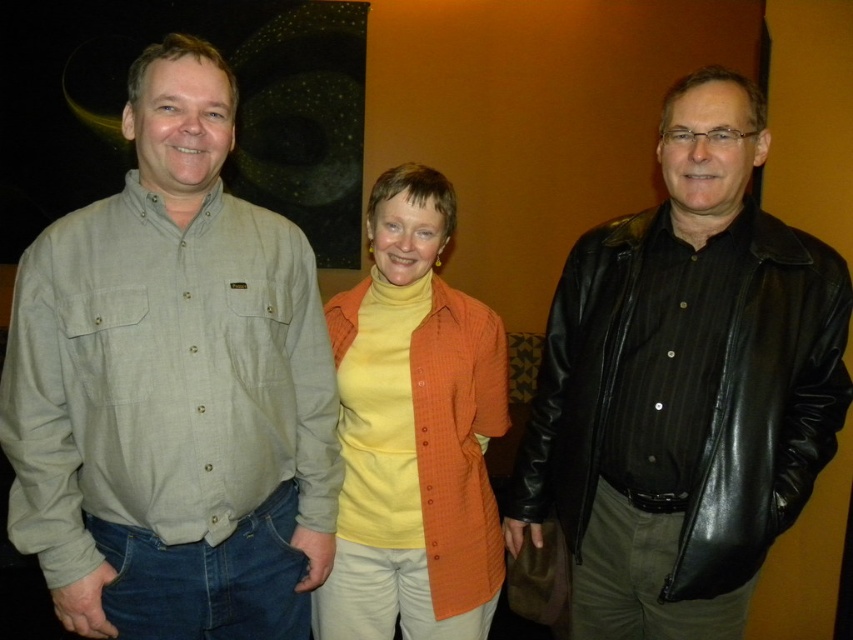
Question: Is black leather jacket at right thinner than orange textured cardigan at center?

Choices:
 (A) no
 (B) yes

Answer: (A)

Question: Which point is closer to the camera taking this photo?

Choices:
 (A) tap(352, 320)
 (B) tap(62, 444)

Answer: (B)

Question: Is black leather jacket at right positioned before orange textured cardigan at center?

Choices:
 (A) no
 (B) yes

Answer: (B)

Question: Among these points, which one is nearest to the camera?

Choices:
 (A) (701, 474)
 (B) (119, 518)

Answer: (B)

Question: Among these points, which one is farthest from the camera?

Choices:
 (A) (398, 305)
 (B) (190, 332)

Answer: (A)

Question: Is light gray button-down shirt at left to the right of black leather jacket at right from the viewer's perspective?

Choices:
 (A) no
 (B) yes

Answer: (A)